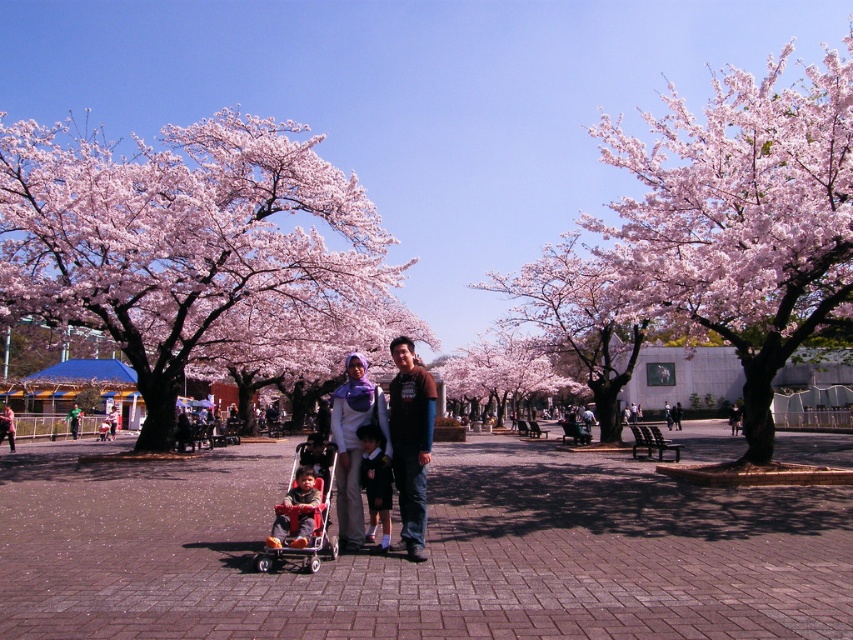
You are a photographer trying to capture a clear shot of both the pink blossoming tree at center and the matte white hijab at center. Which object should you focus on first to ensure both are in focus?

You should focus on the pink blossoming tree at center first because it is closer to the viewer than the matte white hijab at center, so adjusting focus from near to far will help both be in focus.

Consider the image. You are a photographer setting up a shot of the family in the park. You need to ensure the pink blossom tree at center and the matte red stroller at lower left are both in frame. Considering their sizes, which object will occupy more space in the photo?

The pink blossom tree at center will occupy more space in the photo because its width surpasses that of the matte red stroller at lower left.